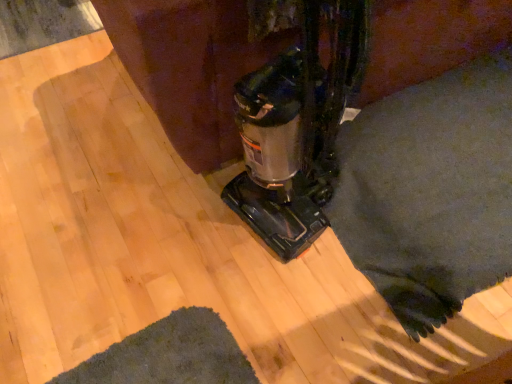
The width and height of the screenshot is (512, 384). In order to click on free spot in front of metallic black vacuum cleaner at center in this screenshot , I will do `click(291, 304)`.